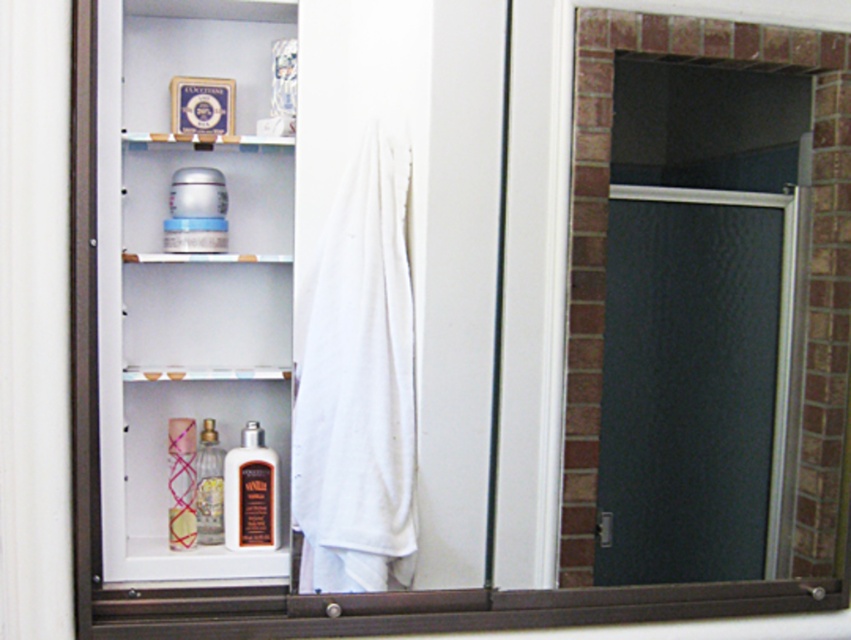
Question: Which object is farther from the camera taking this photo?

Choices:
 (A) translucent glass bottles at center
 (B) black mesh screen door at right

Answer: (B)

Question: Estimate the real-world distances between objects in this image. Which object is farther from the translucent glass bottles at center?

Choices:
 (A) white cotton robe at center
 (B) translucent glass perfume bottle at center
 (C) white glossy cabinet at center

Answer: (A)

Question: Does black mesh screen door at right appear over brown matte lotion at center?

Choices:
 (A) yes
 (B) no

Answer: (A)

Question: Is white glossy cabinet at center in front of translucent pink glass tube at lower left?

Choices:
 (A) yes
 (B) no

Answer: (A)

Question: Does translucent glass bottles at center appear under brown matte lotion at center?

Choices:
 (A) no
 (B) yes

Answer: (A)

Question: Among these points, which one is farthest from the camera?

Choices:
 (A) (266, 451)
 (B) (129, 116)
 (C) (269, 442)
 (D) (180, 422)

Answer: (C)